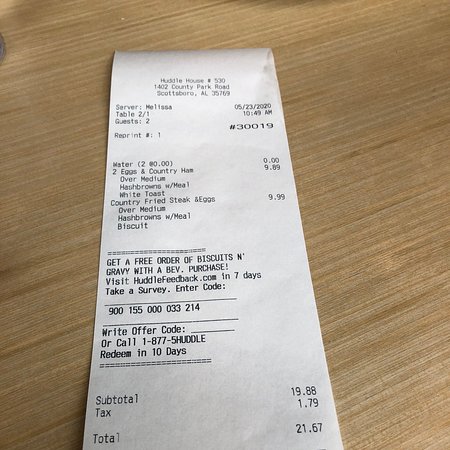
You are a GUI agent. You are given a task and a screenshot of the screen. Output one action in this format:
    pyautogui.click(x=<x>, y=<y>)
    Task: Click on the left side of table
    Image resolution: width=450 pixels, height=450 pixels.
    Given the screenshot: What is the action you would take?
    pyautogui.click(x=8, y=235), pyautogui.click(x=10, y=328)